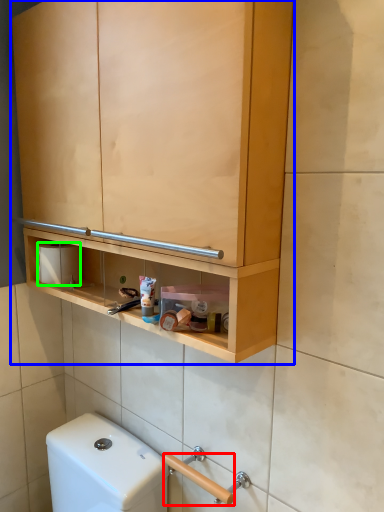
Question: Estimate the real-world distances between objects in this image. Which object is closer to door handle (highlighted by a red box), cabinetry (highlighted by a blue box) or toilet paper (highlighted by a green box)?

Choices:
 (A) cabinetry
 (B) toilet paper

Answer: (B)